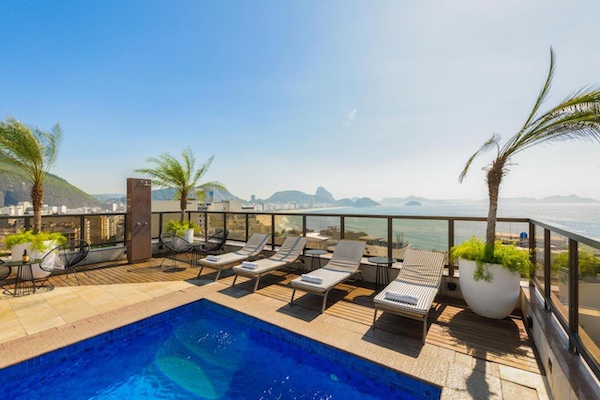
Identify the location of large plant pot. The width and height of the screenshot is (600, 400). (39, 254), (185, 234), (487, 292), (583, 291).